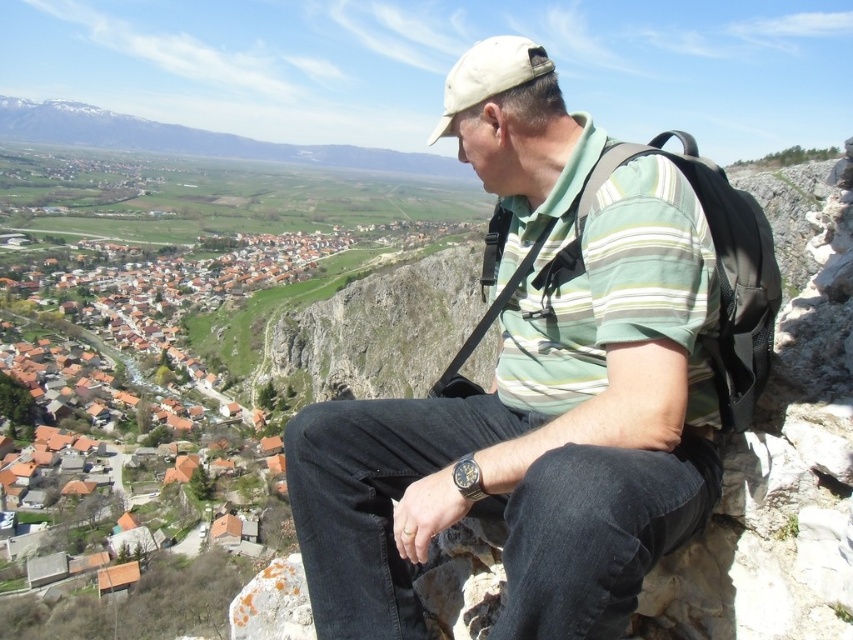
Question: Which of the following is the closest to the observer?

Choices:
 (A) (746, 252)
 (B) (416, 460)

Answer: (A)

Question: Does matte green striped shirt at center appear on the right side of black fabric backpack at center?

Choices:
 (A) yes
 (B) no

Answer: (B)

Question: Is matte green striped shirt at center below black fabric backpack at center?

Choices:
 (A) yes
 (B) no

Answer: (A)

Question: Among these points, which one is farthest from the camera?

Choices:
 (A) click(730, 257)
 (B) click(462, 438)

Answer: (B)

Question: Is matte green striped shirt at center to the left of black fabric backpack at center from the viewer's perspective?

Choices:
 (A) yes
 (B) no

Answer: (A)